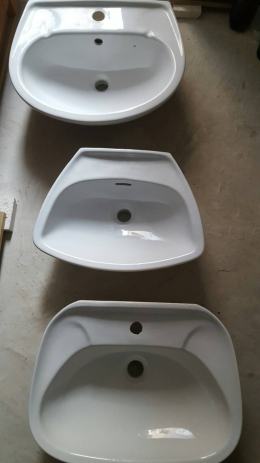
I want to click on basin, so click(136, 417), click(136, 230), click(135, 61).